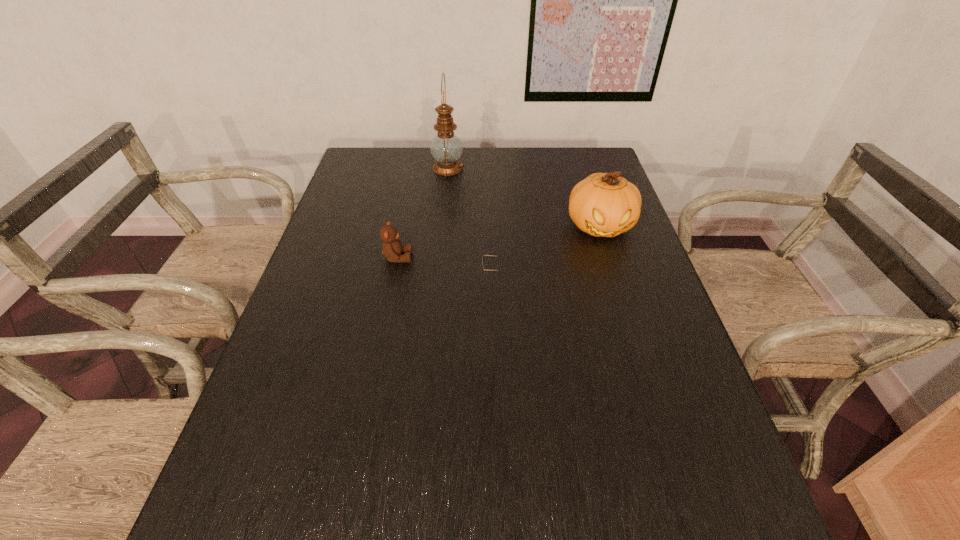
The width and height of the screenshot is (960, 540). In order to click on vacant region located on the face of the teddy bear in this screenshot , I will do `click(531, 258)`.

Image resolution: width=960 pixels, height=540 pixels. I want to click on free spot located 0.350m in front of the lenses of the shortest object, so click(x=345, y=277).

Find the location of `free space located in front of the lenses of the shortest object`. free space located in front of the lenses of the shortest object is located at coordinates (462, 277).

Locate an element on the screen. Image resolution: width=960 pixels, height=540 pixels. vacant space situated in front of the lenses of the shortest object is located at coordinates (345, 277).

The image size is (960, 540). I want to click on object located at the far edge, so click(446, 148).

Where is `object at the right edge`? The width and height of the screenshot is (960, 540). object at the right edge is located at coordinates (604, 205).

In the image, there is a desktop. Where is `free space at the far edge`? The image size is (960, 540). free space at the far edge is located at coordinates (407, 179).

Image resolution: width=960 pixels, height=540 pixels. In order to click on vacant space at the right edge of the desktop in this screenshot , I will do `click(614, 255)`.

Image resolution: width=960 pixels, height=540 pixels. I want to click on free space at the far right corner, so click(560, 159).

At what (x,y) coordinates should I click in order to perform the action: click on free space between the shortest object and the third tallest object. Please return your answer as a coordinate pair (x, y). Looking at the image, I should click on (445, 267).